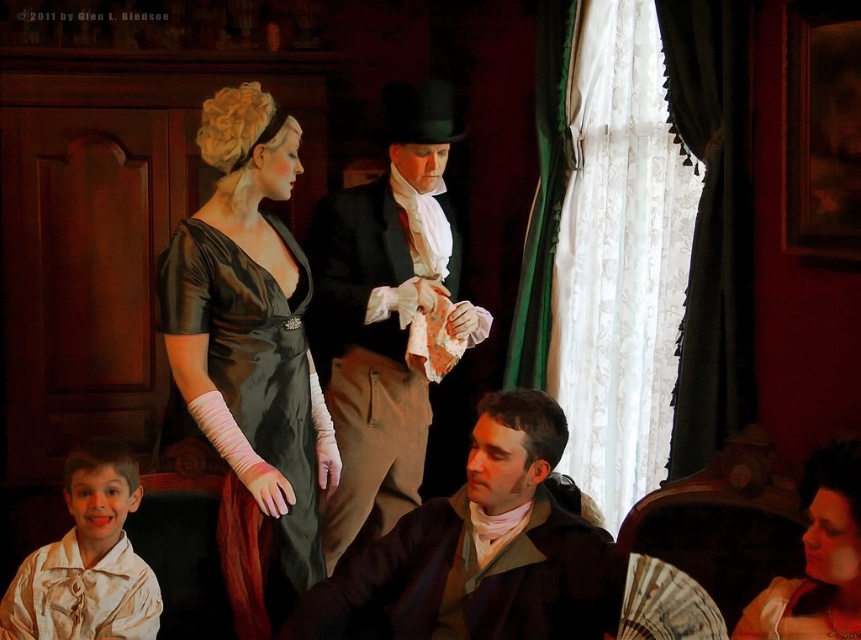
Does smooth black suit at center have a lesser width compared to velvet red dress at center?

In fact, smooth black suit at center might be wider than velvet red dress at center.

Which is above, smooth black suit at center or velvet red dress at center?

smooth black suit at center is above.

The width and height of the screenshot is (861, 640). What do you see at coordinates (383, 310) in the screenshot?
I see `smooth black suit at center` at bounding box center [383, 310].

Find the location of a particular element. The width and height of the screenshot is (861, 640). smooth black suit at center is located at coordinates [383, 310].

Which is in front, point (75, 464) or point (756, 596)?

Point (756, 596)

Is point (59, 598) positioned before point (828, 502)?

No, (59, 598) is further to viewer.

Which is in front, point (104, 454) or point (760, 627)?

Positioned in front is point (760, 627).

The image size is (861, 640). Find the location of `white satin shirt at lower left`. white satin shirt at lower left is located at coordinates (87, 561).

Can you confirm if smooth black suit at center is positioned to the right of matte brown coat at center?

Incorrect, smooth black suit at center is not on the right side of matte brown coat at center.

What do you see at coordinates (383, 310) in the screenshot? The height and width of the screenshot is (640, 861). I see `smooth black suit at center` at bounding box center [383, 310].

Find the location of a particular element. The width and height of the screenshot is (861, 640). smooth black suit at center is located at coordinates (383, 310).